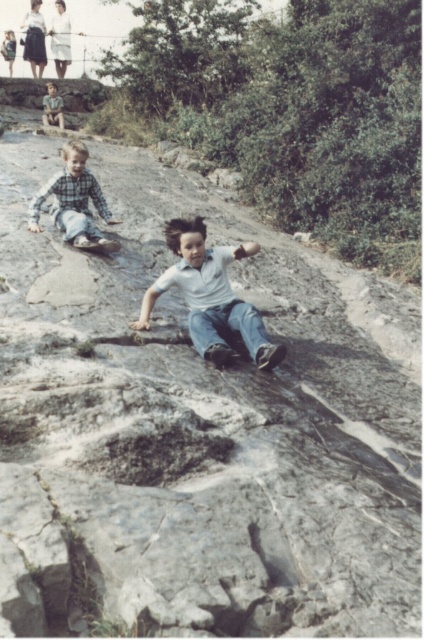
You are a photographer trying to capture both the white matte shirt at center and the checkered fabric shirt at left in a single shot. Based on their positions, which direction should you move your camera to include both subjects?

Since the white matte shirt at center is to the right of the checkered fabric shirt at left, you should move your camera to the left to include both subjects in the frame.

You are a photographer trying to capture the two points in the image. Which point, point (x=84, y=193) or point (x=50, y=120), will appear larger in your photo?

Point (x=84, y=193) is closer to the viewer than point (x=50, y=120), so it will appear larger in the photo.

You are a photographer trying to capture a photo of both the checkered fabric shirt at left and the light brown hair at upper left in the same frame. Which object should you focus on first to ensure both are in focus?

You should focus on the checkered fabric shirt at left first because it is closer to the viewer than the light brown hair at upper left, so adjusting focus from near to far will help both be in focus.